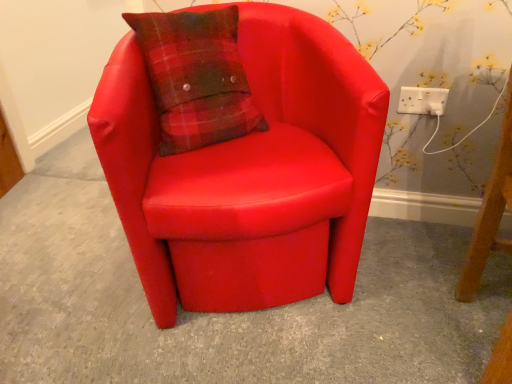
Question: Considering the positions of matte red armchair at center and white plastic socket at upper right in the image, is matte red armchair at center bigger or smaller than white plastic socket at upper right?

Choices:
 (A) small
 (B) big

Answer: (B)

Question: From a real-world perspective, is matte red armchair at center above or below white plastic socket at upper right?

Choices:
 (A) below
 (B) above

Answer: (A)

Question: Considering the positions of point (361, 185) and point (401, 99), is point (361, 185) closer or farther from the camera than point (401, 99)?

Choices:
 (A) closer
 (B) farther

Answer: (A)

Question: Is white plastic socket at upper right to the left or to the right of matte red armchair at center in the image?

Choices:
 (A) left
 (B) right

Answer: (B)

Question: Is white plastic socket at upper right wider or thinner than matte red armchair at center?

Choices:
 (A) thin
 (B) wide

Answer: (A)

Question: From the image's perspective, is white plastic socket at upper right above or below matte red armchair at center?

Choices:
 (A) above
 (B) below

Answer: (A)

Question: In terms of size, does white plastic socket at upper right appear bigger or smaller than matte red armchair at center?

Choices:
 (A) small
 (B) big

Answer: (A)